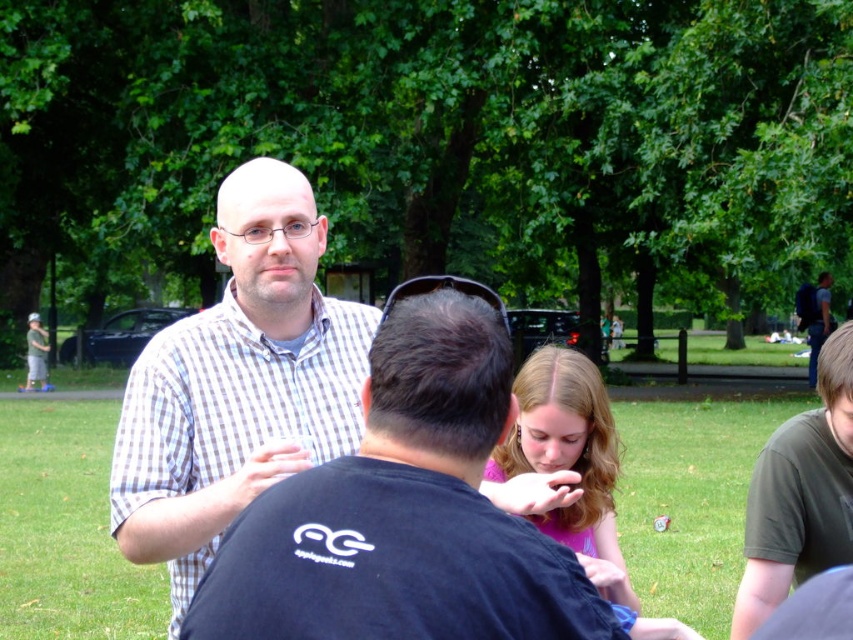
Which is more to the left, white checkered shirt at center or green grass at center?

From the viewer's perspective, white checkered shirt at center appears more on the left side.

Who is more forward, (128,500) or (6,417)?

Point (128,500) is in front.

The height and width of the screenshot is (640, 853). I want to click on white checkered shirt at center, so click(x=238, y=384).

This screenshot has height=640, width=853. In order to click on green grass at center in this screenshot , I will do [65, 531].

Image resolution: width=853 pixels, height=640 pixels. I want to click on green grass at center, so click(65, 531).

Is white checkered shirt at center positioned at the back of dark green t-shirt at lower right?

No, it is in front of dark green t-shirt at lower right.

Describe the element at coordinates (238, 384) in the screenshot. I see `white checkered shirt at center` at that location.

Find the location of a particular element. This screenshot has height=640, width=853. white checkered shirt at center is located at coordinates (238, 384).